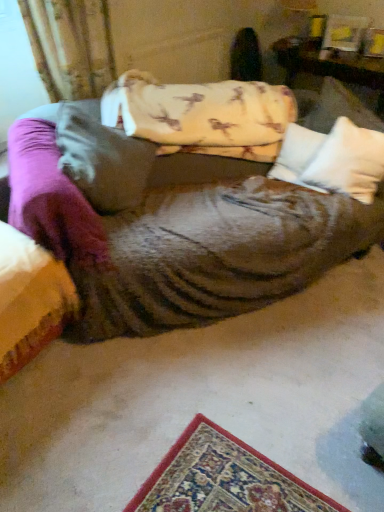
Question: From the image's perspective, is white soft pillow at center, the 3th pillow viewed from the left, located above or below white soft pillow at center, which is the 2th pillow from right to left?

Choices:
 (A) below
 (B) above

Answer: (A)

Question: Would you say white soft pillow at center, the 3th pillow viewed from the left, is to the left or to the right of white soft pillow at center, which is the 2th pillow from right to left, in the picture?

Choices:
 (A) right
 (B) left

Answer: (A)

Question: Considering the real-world distances, which object is closest to the white soft pillow at center, the 3th pillow viewed from the left?

Choices:
 (A) fluffy white pillow at center, positioned as the first pillow in left-to-right order
 (B) wooden table at upper right
 (C) white soft pillow at center, which is the 2th pillow from right to left

Answer: (C)

Question: Estimate the real-world distances between objects in this image. Which object is farther from the fluffy white pillow at center, marked as the third pillow in a right-to-left arrangement?

Choices:
 (A) white soft pillow at center, which is the 2th pillow from right to left
 (B) white soft pillow at center, the 1th pillow positioned from the right
 (C) wooden table at upper right

Answer: (C)